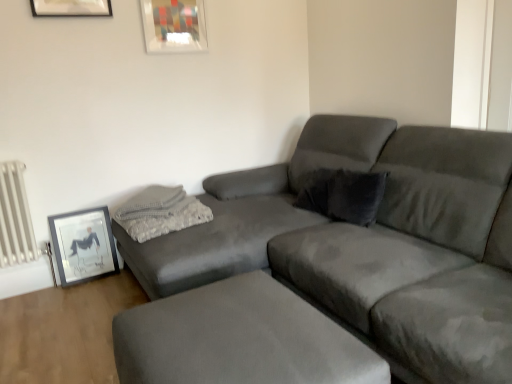
What is the approximate height of matte glass picture frame at upper center, which is counted as the 1th picture frame, starting from the right?

It is 13.60 inches.

The width and height of the screenshot is (512, 384). What are the coordinates of `matte black picture frame at lower left, placed as the 2th picture frame when sorted from right to left` in the screenshot? It's located at (83, 245).

Locate an element on the screen. The height and width of the screenshot is (384, 512). velvet gray pillow at upper right, marked as the first pillow in a right-to-left arrangement is located at coordinates (342, 194).

Identify the location of gray textured pillow at upper left, the 1th pillow positioned from the left. (160, 212).

Considering the relative positions of matte black picture frame at lower left, the first picture frame positioned from the left, and matte glass picture frame at upper center, which is counted as the 1th picture frame, starting from the right, in the image provided, is matte black picture frame at lower left, the first picture frame positioned from the left, to the left of matte glass picture frame at upper center, which is counted as the 1th picture frame, starting from the right, from the viewer's perspective?

Correct, you'll find matte black picture frame at lower left, the first picture frame positioned from the left, to the left of matte glass picture frame at upper center, which is counted as the 1th picture frame, starting from the right.

From a real-world perspective, is matte black picture frame at lower left, the first picture frame positioned from the left, on top of matte glass picture frame at upper center, which is counted as the 1th picture frame, starting from the right?

Actually, matte black picture frame at lower left, the first picture frame positioned from the left, is physically below matte glass picture frame at upper center, which is counted as the 1th picture frame, starting from the right, in the real world.

From the image's perspective, is matte black picture frame at lower left, placed as the 2th picture frame when sorted from right to left, located above matte glass picture frame at upper center, positioned as the second picture frame in bottom-to-top order?

No, from the image's perspective, matte black picture frame at lower left, placed as the 2th picture frame when sorted from right to left, is not on top of matte glass picture frame at upper center, positioned as the second picture frame in bottom-to-top order.

Considering the relative positions of white metallic radiator at left and suede footrest at lower center in the image provided, is white metallic radiator at left to the left of suede footrest at lower center from the viewer's perspective?

Indeed, white metallic radiator at left is positioned on the left side of suede footrest at lower center.

Relative to suede footrest at lower center, is white metallic radiator at left in front or behind?

white metallic radiator at left is behind suede footrest at lower center.

Between white metallic radiator at left and suede footrest at lower center, which one has larger size?

Bigger between the two is suede footrest at lower center.

Looking at this image, from the image's perspective, between white metallic radiator at left and suede footrest at lower center, who is located below?

suede footrest at lower center is shown below in the image.

Between velvet gray pillow at upper right, marked as the first pillow in a right-to-left arrangement, and matte glass picture frame at upper center, the 2th picture frame viewed from the left, which one has less height?

With less height is velvet gray pillow at upper right, marked as the first pillow in a right-to-left arrangement.

Is velvet gray pillow at upper right, marked as the 2th pillow in a left-to-right arrangement, outside of matte glass picture frame at upper center, which is counted as the 1th picture frame, starting from the right?

That's correct, velvet gray pillow at upper right, marked as the 2th pillow in a left-to-right arrangement, is outside of matte glass picture frame at upper center, which is counted as the 1th picture frame, starting from the right.

The image size is (512, 384). What are the coordinates of `picture frame above the velvet gray pillow at upper right, marked as the 2th pillow in a left-to-right arrangement (from the image's perspective)` in the screenshot? It's located at (174, 26).

Between suede gray couch at center and gray textured pillow at upper left, the 1th pillow positioned from the left, which one appears on the right side from the viewer's perspective?

suede gray couch at center is more to the right.

From a real-world perspective, is suede gray couch at center on gray textured pillow at upper left, the 1th pillow positioned from the left?

Yes, from a real-world perspective, suede gray couch at center is above gray textured pillow at upper left, the 1th pillow positioned from the left.

Which is behind, suede gray couch at center or gray textured pillow at upper left, the 1th pillow positioned from the left?

gray textured pillow at upper left, the 1th pillow positioned from the left, is more distant.

Considering the points (294, 235) and (174, 219), which point is behind, point (294, 235) or point (174, 219)?

The point (174, 219) is farther from the camera.

Is gray textured pillow at upper left, which ranks as the second pillow in right-to-left order, spatially inside matte black picture frame at lower left, placed as the 2th picture frame when sorted from right to left, or outside of it?

gray textured pillow at upper left, which ranks as the second pillow in right-to-left order, is located beyond the bounds of matte black picture frame at lower left, placed as the 2th picture frame when sorted from right to left.

In the image, is gray textured pillow at upper left, which ranks as the second pillow in right-to-left order, positioned in front of or behind matte black picture frame at lower left, which is the first picture frame from bottom to top?

In the image, gray textured pillow at upper left, which ranks as the second pillow in right-to-left order, appears in front of matte black picture frame at lower left, which is the first picture frame from bottom to top.

Are gray textured pillow at upper left, the 1th pillow positioned from the left, and matte black picture frame at lower left, acting as the 2th picture frame starting from the top, located far from each other?

No, gray textured pillow at upper left, the 1th pillow positioned from the left, is not far away from matte black picture frame at lower left, acting as the 2th picture frame starting from the top.

Who is bigger, gray textured pillow at upper left, the 1th pillow positioned from the left, or matte black picture frame at lower left, the first picture frame positioned from the left?

With larger size is gray textured pillow at upper left, the 1th pillow positioned from the left.

Is suede gray couch at center positioned beyond the bounds of suede footrest at lower center?

That's correct, suede gray couch at center is outside of suede footrest at lower center.

Based on their sizes in the image, would you say suede gray couch at center is bigger or smaller than suede footrest at lower center?

Clearly, suede gray couch at center is larger in size than suede footrest at lower center.

In the image, is suede gray couch at center positioned in front of or behind suede footrest at lower center?

Clearly, suede gray couch at center is behind suede footrest at lower center.

Considering the sizes of suede gray couch at center and suede footrest at lower center in the image, is suede gray couch at center wider or thinner than suede footrest at lower center?

Clearly, suede gray couch at center has more width compared to suede footrest at lower center.

Could you measure the distance between matte glass picture frame at upper center, positioned as the second picture frame in bottom-to-top order, and suede footrest at lower center?

They are 6.26 feet apart.

Is point (165, 1) closer to viewer compared to point (252, 347)?

No.

From the picture: From the image's perspective, relative to suede footrest at lower center, is matte glass picture frame at upper center, which is counted as the 1th picture frame, starting from the right, above or below?

Clearly, from the image's perspective, matte glass picture frame at upper center, which is counted as the 1th picture frame, starting from the right, is above suede footrest at lower center.

Does matte glass picture frame at upper center, the 2th picture frame viewed from the left, lie in front of suede footrest at lower center?

No, matte glass picture frame at upper center, the 2th picture frame viewed from the left, is further to the viewer.

Where is `picture frame in front of the matte glass picture frame at upper center, positioned as the second picture frame in bottom-to-top order`? picture frame in front of the matte glass picture frame at upper center, positioned as the second picture frame in bottom-to-top order is located at coordinates (83, 245).

Identify the location of footrest below the white metallic radiator at left (from a real-world perspective). This screenshot has width=512, height=384. (239, 339).

When comparing their distances from matte black picture frame at lower left, the first picture frame positioned from the left, does suede gray couch at center or white metallic radiator at left seem closer?

Based on the image, white metallic radiator at left appears to be nearer to matte black picture frame at lower left, the first picture frame positioned from the left.

From the picture: Estimate the real-world distances between objects in this image. Which object is further from velvet gray pillow at upper right, marked as the first pillow in a right-to-left arrangement, suede gray couch at center or matte black picture frame at lower left, placed as the 2th picture frame when sorted from right to left?

matte black picture frame at lower left, placed as the 2th picture frame when sorted from right to left, is further to velvet gray pillow at upper right, marked as the first pillow in a right-to-left arrangement.

From the image, which object appears to be farther from matte black picture frame at lower left, acting as the 2th picture frame starting from the top, velvet gray pillow at upper right, marked as the 2th pillow in a left-to-right arrangement, or suede gray couch at center?

The object further to matte black picture frame at lower left, acting as the 2th picture frame starting from the top, is velvet gray pillow at upper right, marked as the 2th pillow in a left-to-right arrangement.

Estimate the real-world distances between objects in this image. Which object is further from velvet gray pillow at upper right, marked as the 2th pillow in a left-to-right arrangement, white metallic radiator at left or suede footrest at lower center?

white metallic radiator at left lies further to velvet gray pillow at upper right, marked as the 2th pillow in a left-to-right arrangement, than the other object.

Estimate the real-world distances between objects in this image. Which object is further from matte black picture frame at lower left, placed as the 2th picture frame when sorted from right to left, gray textured pillow at upper left, the 1th pillow positioned from the left, or white metallic radiator at left?

gray textured pillow at upper left, the 1th pillow positioned from the left, lies further to matte black picture frame at lower left, placed as the 2th picture frame when sorted from right to left, than the other object.

Considering their positions, is matte black picture frame at lower left, placed as the 2th picture frame when sorted from right to left, positioned closer to suede gray couch at center than matte glass picture frame at upper center, positioned as the second picture frame in bottom-to-top order?

The object closer to suede gray couch at center is matte black picture frame at lower left, placed as the 2th picture frame when sorted from right to left.

Looking at this image, which object lies nearer to the anchor point gray textured pillow at upper left, which ranks as the second pillow in right-to-left order, matte black picture frame at lower left, the first picture frame positioned from the left, or white metallic radiator at left?

matte black picture frame at lower left, the first picture frame positioned from the left, is positioned closer to the anchor gray textured pillow at upper left, which ranks as the second pillow in right-to-left order.

Based on the photo, from the image, which object appears to be nearer to velvet gray pillow at upper right, marked as the first pillow in a right-to-left arrangement, suede gray couch at center or matte glass picture frame at upper center, the 2th picture frame viewed from the left?

The object closer to velvet gray pillow at upper right, marked as the first pillow in a right-to-left arrangement, is suede gray couch at center.

Find the location of a particular element. This screenshot has height=384, width=512. radiator between matte glass picture frame at upper center, the 2th picture frame viewed from the left, and matte black picture frame at lower left, which is the first picture frame from bottom to top, vertically is located at coordinates (15, 217).

Image resolution: width=512 pixels, height=384 pixels. In order to click on pillow between gray textured pillow at upper left, which ranks as the second pillow in right-to-left order, and suede gray couch at center from left to right in this screenshot , I will do `click(342, 194)`.

You are a GUI agent. You are given a task and a screenshot of the screen. Output one action in this format:
    pyautogui.click(x=<x>, y=<y>)
    Task: Click on the picture frame between suede footrest at lower center and matte glass picture frame at upper center, which is counted as the 1th picture frame, starting from the right, along the z-axis
    This screenshot has width=512, height=384.
    Given the screenshot: What is the action you would take?
    pyautogui.click(x=83, y=245)

Locate an element on the screen. Image resolution: width=512 pixels, height=384 pixels. pillow between matte black picture frame at lower left, acting as the 2th picture frame starting from the top, and velvet gray pillow at upper right, marked as the 2th pillow in a left-to-right arrangement is located at coordinates (160, 212).